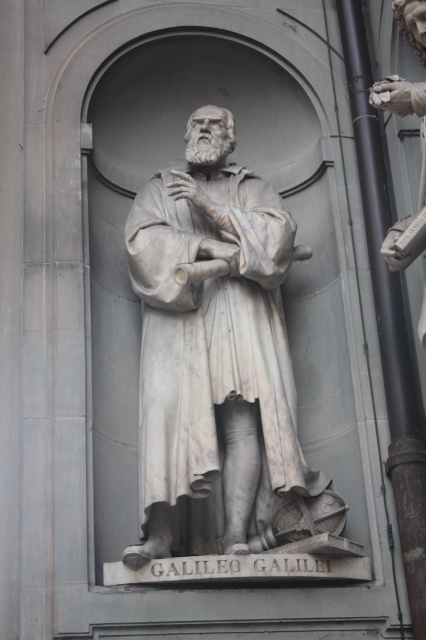
Does white marble statue at center appear on the left side of polished bronze hand at upper right?

Indeed, white marble statue at center is positioned on the left side of polished bronze hand at upper right.

Can you confirm if white marble statue at center is thinner than polished bronze hand at upper right?

No.

Image resolution: width=426 pixels, height=640 pixels. What do you see at coordinates (213, 344) in the screenshot?
I see `white marble statue at center` at bounding box center [213, 344].

Locate an element on the screen. white marble statue at center is located at coordinates (213, 344).